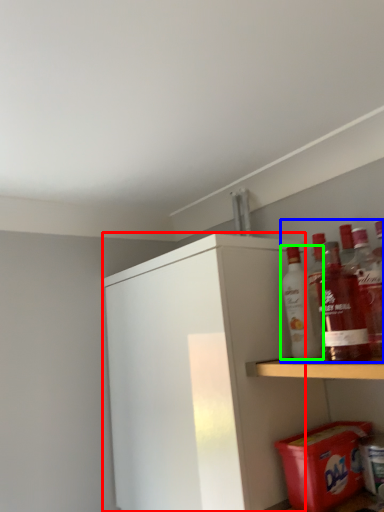
Question: Which is farther away from cabinetry (highlighted by a red box)? beverage (highlighted by a blue box) or bottle (highlighted by a green box)?

Choices:
 (A) beverage
 (B) bottle

Answer: (A)